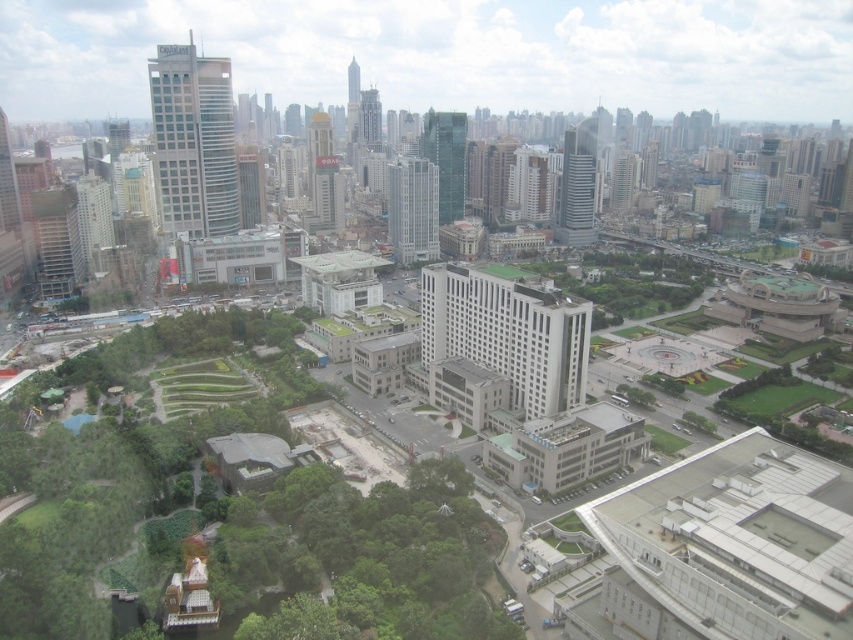
You are a city planner analyzing the aerial view of the urban landscape. You need to determine if the green leafy tree at center can be safely transplanted to a space currently occupied by the gold reflective tower at center. Based on their sizes, is this feasible?

The green leafy tree at center has a larger width than the gold reflective tower at center. Since the tree is wider, transplanting it to the space occupied by the tower may not be feasible due to insufficient space.

You are a drone operator flying over the city. You need to deliver a package to the white smooth building at center. From your current position above the matte gray building at left, in which direction should you fly to reach the target building?

The white smooth building at center is above the matte gray building at left, so you should fly upwards to reach it.

You are a drone operator trying to capture a photo of the glassy steel skyscraper at upper center. There is a green leafy tree at lower left in the way. Can you fly your drone around the tree to get a clear shot of the skyscraper?

The green leafy tree at lower left is in front of the glassy steel skyscraper at upper center, so you can fly your drone around the tree to get a clear shot of the skyscraper.